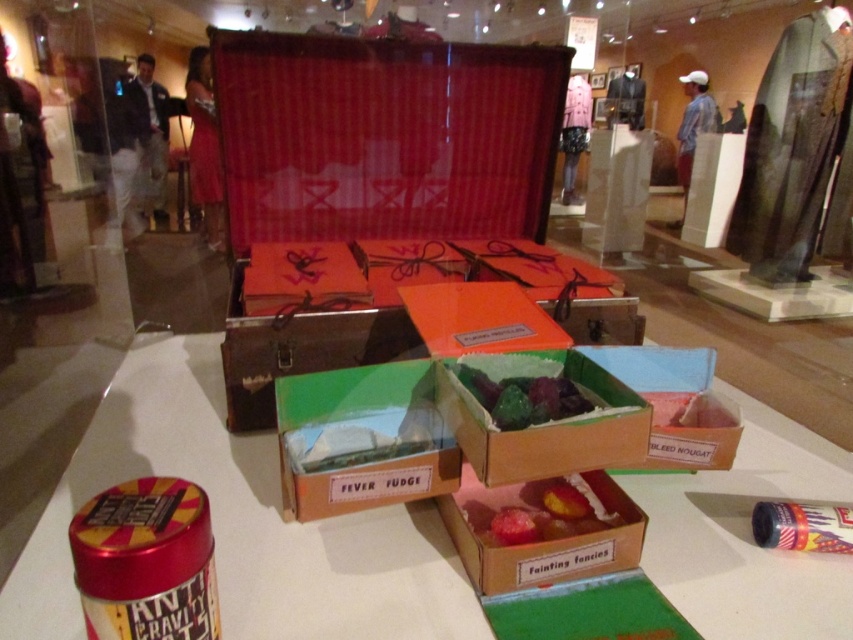
You are standing in front of the museum display and want to touch both the point at location (643, 392) and the point at (399, 429). Which point will you reach first?

The point at location (643, 392) is closer to you, so you will reach it first.

You are a visitor at the exhibition and want to take a photo of both the green cardboard box at center and the shiny green candy at center without moving either item. Can you fit both items in your camera frame if the maximum width your camera can capture is 4.5 inches?

The green cardboard box at center and shiny green candy at center are 4.57 inches apart. Since the distance between them exceeds the camera frame width of 4.5 inches, you cannot fit both items in the frame without moving them.